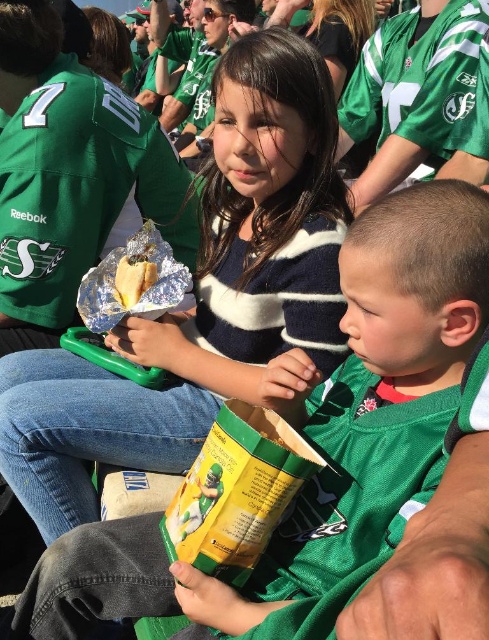
You are a photographer taking a picture of the two children in the stands. You want to ensure both the green matte jersey at center and the striped sweater at center are clearly visible in the photo. Based on their positions, which one is closer to the camera?

The green matte jersey at center is below the striped sweater at center, so the striped sweater at center is closer to the camera.